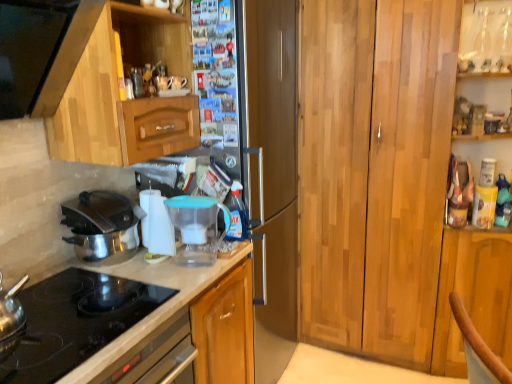
Question: Which direction should I rotate to look at white plastic water filter at center, the first appliance viewed from the left, — up or down?

Choices:
 (A) down
 (B) up

Answer: (A)

Question: Is polished stainless steel pot at left at the right side of wooden cabinet at right, which ranks as the first cabinetry in right-to-left order?

Choices:
 (A) no
 (B) yes

Answer: (A)

Question: Considering the relative positions of polished stainless steel pot at left and wooden cabinet at right, which ranks as the first cabinetry in right-to-left order, in the image provided, is polished stainless steel pot at left to the left of wooden cabinet at right, which ranks as the first cabinetry in right-to-left order, from the viewer's perspective?

Choices:
 (A) no
 (B) yes

Answer: (B)

Question: Is polished stainless steel pot at left turned away from wooden cabinet at right, the 2th cabinetry from the left?

Choices:
 (A) yes
 (B) no

Answer: (B)

Question: Is there a large distance between polished stainless steel pot at left and wooden cabinet at right, the 2th cabinetry from the left?

Choices:
 (A) yes
 (B) no

Answer: (A)

Question: Is wooden cabinet at right, the 2th cabinetry from the left, completely or partially inside polished stainless steel pot at left?

Choices:
 (A) no
 (B) yes

Answer: (A)

Question: Does polished stainless steel pot at left have a smaller size compared to wooden cabinet at right, which ranks as the first cabinetry in right-to-left order?

Choices:
 (A) no
 (B) yes

Answer: (B)

Question: Can you confirm if white glossy countertop at lower left is positioned to the left of polished stainless steel pot at left?

Choices:
 (A) yes
 (B) no

Answer: (B)

Question: Considering the relative sizes of white glossy countertop at lower left and polished stainless steel pot at left in the image provided, is white glossy countertop at lower left thinner than polished stainless steel pot at left?

Choices:
 (A) yes
 (B) no

Answer: (B)

Question: Considering the relative sizes of white glossy countertop at lower left and polished stainless steel pot at left in the image provided, is white glossy countertop at lower left bigger than polished stainless steel pot at left?

Choices:
 (A) no
 (B) yes

Answer: (B)

Question: From a real-world perspective, is white glossy countertop at lower left physically above polished stainless steel pot at left?

Choices:
 (A) no
 (B) yes

Answer: (A)

Question: Is white glossy countertop at lower left wider than polished stainless steel pot at left?

Choices:
 (A) no
 (B) yes

Answer: (B)

Question: Can you confirm if white glossy countertop at lower left is smaller than polished stainless steel pot at left?

Choices:
 (A) no
 (B) yes

Answer: (A)

Question: From the image's perspective, is white plastic water filter at center, which is counted as the 2th appliance, starting from the right, under polished stainless steel pot at left?

Choices:
 (A) yes
 (B) no

Answer: (B)